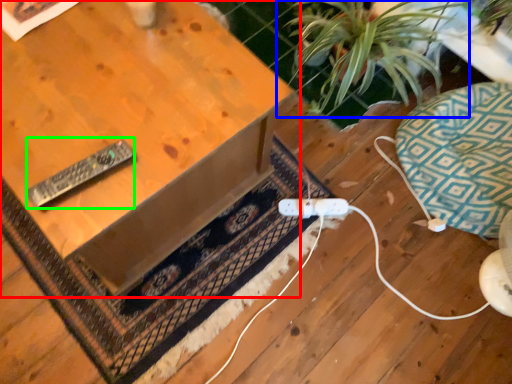
Question: Which object is the farthest from table (highlighted by a red box)? Choose among these: houseplant (highlighted by a blue box) or remote (highlighted by a green box).

Choices:
 (A) houseplant
 (B) remote

Answer: (A)